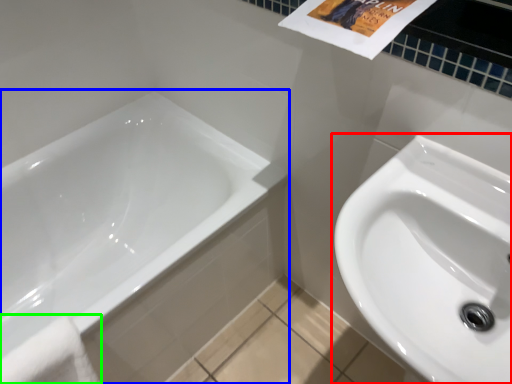
Question: Considering the real-world distances, which object is closest to sink (highlighted by a red box)? bathtub (highlighted by a blue box) or bath towel (highlighted by a green box).

Choices:
 (A) bathtub
 (B) bath towel

Answer: (A)